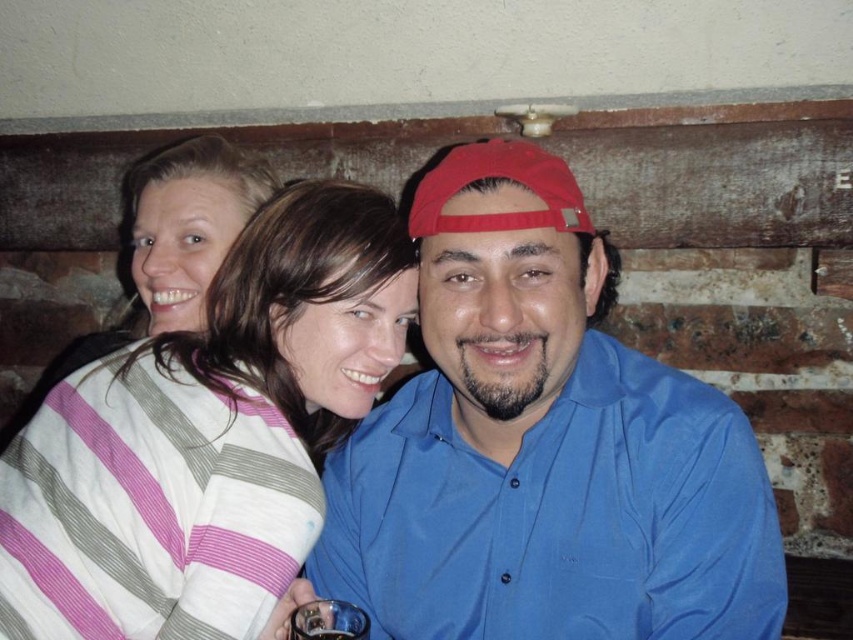
What do you see at coordinates (543, 445) in the screenshot? This screenshot has height=640, width=853. I see `blue cotton shirt at center` at bounding box center [543, 445].

Between blue cotton shirt at center and striped sweater at upper left, which one is positioned higher?

striped sweater at upper left is above.

Who is more distant from viewer, (387, 632) or (155, 253)?

Positioned behind is point (155, 253).

At what (x,y) coordinates should I click in order to perform the action: click on blue cotton shirt at center. Please return your answer as a coordinate pair (x, y). Image resolution: width=853 pixels, height=640 pixels. Looking at the image, I should click on (543, 445).

How distant is striped cotton shirt at center from striped sweater at upper left?

15.20 inches

Looking at this image, is striped cotton shirt at center positioned before striped sweater at upper left?

Yes, it is.

Is point (117, 493) positioned in front of point (183, 243)?

That is True.

Find the location of a particular element. The width and height of the screenshot is (853, 640). striped cotton shirt at center is located at coordinates (207, 436).

Based on the photo, is blue cotton shirt at center wider than striped cotton shirt at center?

Indeed, blue cotton shirt at center has a greater width compared to striped cotton shirt at center.

Does blue cotton shirt at center appear on the right side of striped cotton shirt at center?

Correct, you'll find blue cotton shirt at center to the right of striped cotton shirt at center.

Which is in front, point (556, 160) or point (186, 500)?

Point (186, 500)

Where is `blue cotton shirt at center`? blue cotton shirt at center is located at coordinates (543, 445).